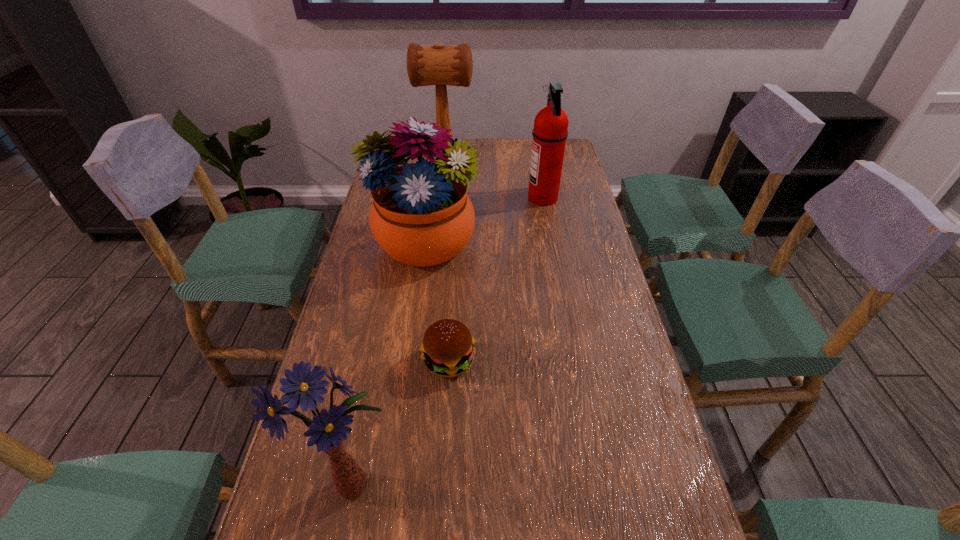
In the image, there is a desktop. What are the coordinates of `free space at the right edge` in the screenshot? It's located at (580, 232).

What are the coordinates of `free space between the nearer flower arrangement and the fourth farthest object` in the screenshot? It's located at (402, 423).

What are the coordinates of `vacant point located between the nearer flower arrangement and the shortest object` in the screenshot? It's located at (402, 423).

You are a GUI agent. You are given a task and a screenshot of the screen. Output one action in this format:
    pyautogui.click(x=<x>, y=<y>)
    Task: Click on the vacant space in between the rightmost object and the farther flower arrangement
    This screenshot has height=540, width=960.
    Given the screenshot: What is the action you would take?
    pyautogui.click(x=483, y=221)

Find the location of a particular element. Image resolution: width=960 pixels, height=540 pixels. the fourth closest object to the second nearest object is located at coordinates (438, 65).

This screenshot has width=960, height=540. What are the coordinates of `object that ranks as the third closest to the nearest object` in the screenshot? It's located at (550, 131).

Find the location of `vacant space that satisfies the following two spatial constraints: 1. on the strike surface of the farthest object; 2. on the right side of the hamburger`. vacant space that satisfies the following two spatial constraints: 1. on the strike surface of the farthest object; 2. on the right side of the hamburger is located at coordinates (421, 361).

The height and width of the screenshot is (540, 960). Identify the location of blank area in the image that satisfies the following two spatial constraints: 1. on the back side of the farther flower arrangement; 2. on the right side of the nearest object. (403, 244).